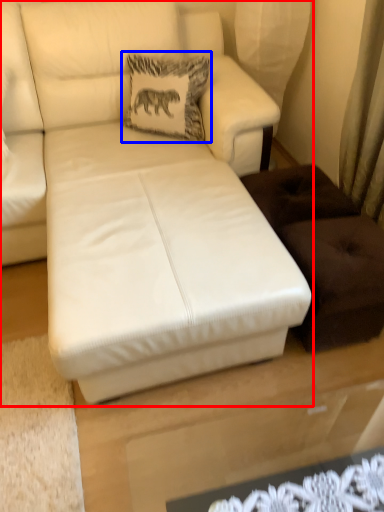
Question: Which object is closer to the camera taking this photo, studio couch (highlighted by a red box) or pillow (highlighted by a blue box)?

Choices:
 (A) studio couch
 (B) pillow

Answer: (A)